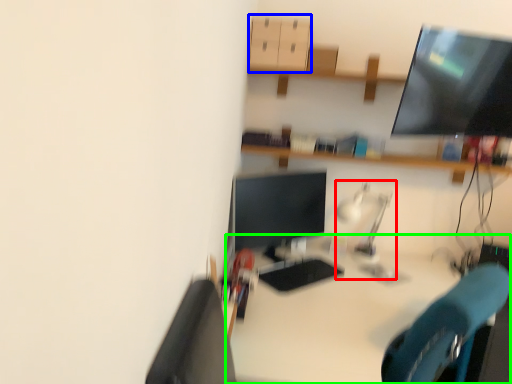
Question: Based on their relative distances, which object is nearer to table lamp (highlighted by a red box)? Choose from drawer (highlighted by a blue box) and desk (highlighted by a green box).

Choices:
 (A) drawer
 (B) desk

Answer: (B)